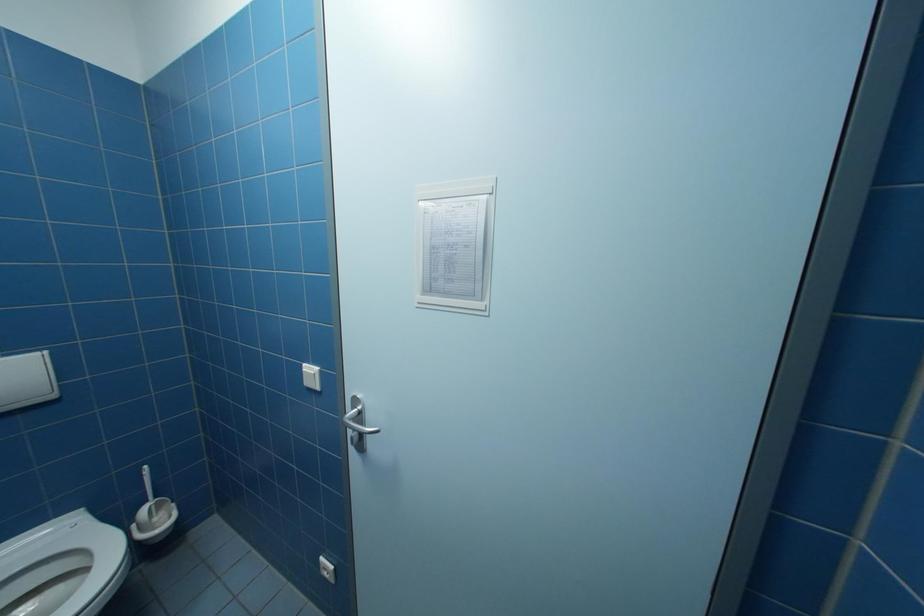
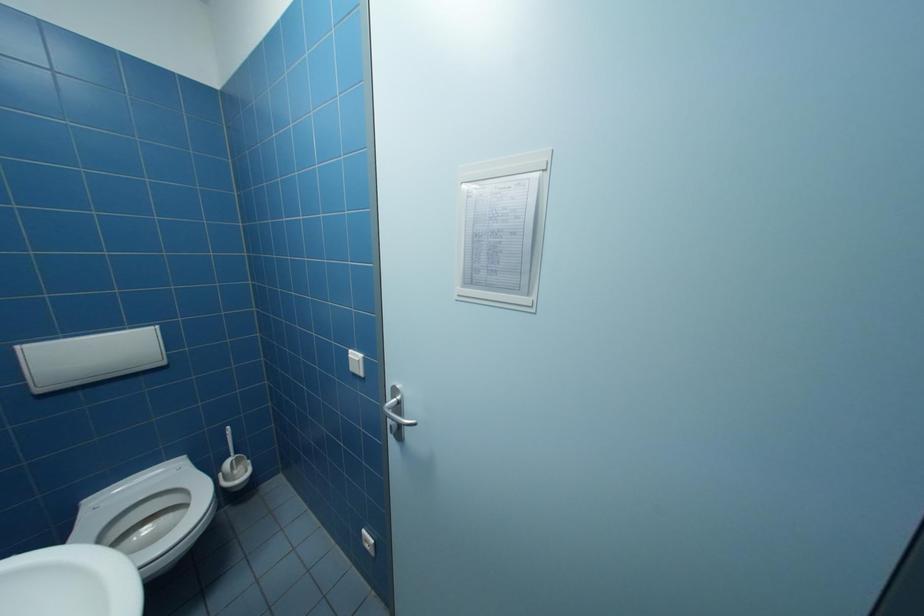
Question: How did the camera likely rotate?

Choices:
 (A) Left
 (B) Right
 (C) Up
 (D) Down

Answer: (A)